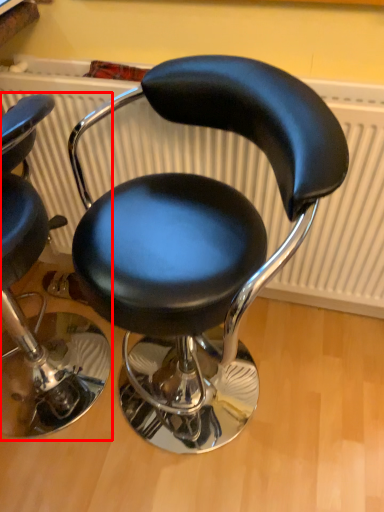
Question: From the image's perspective, what is the correct spatial relationship of chair (annotated by the red box) in relation to chair?

Choices:
 (A) below
 (B) above

Answer: (B)